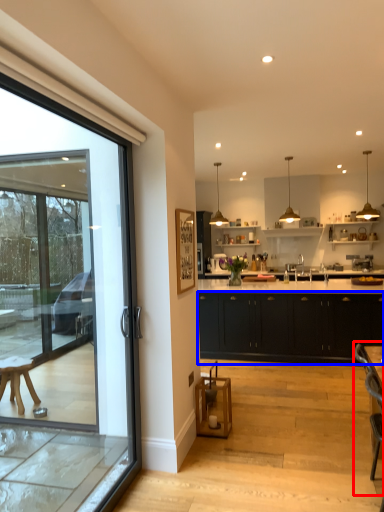
Question: Which object appears closest to the camera in this image, armchair (highlighted by a red box) or cabinetry (highlighted by a blue box)?

Choices:
 (A) armchair
 (B) cabinetry

Answer: (A)